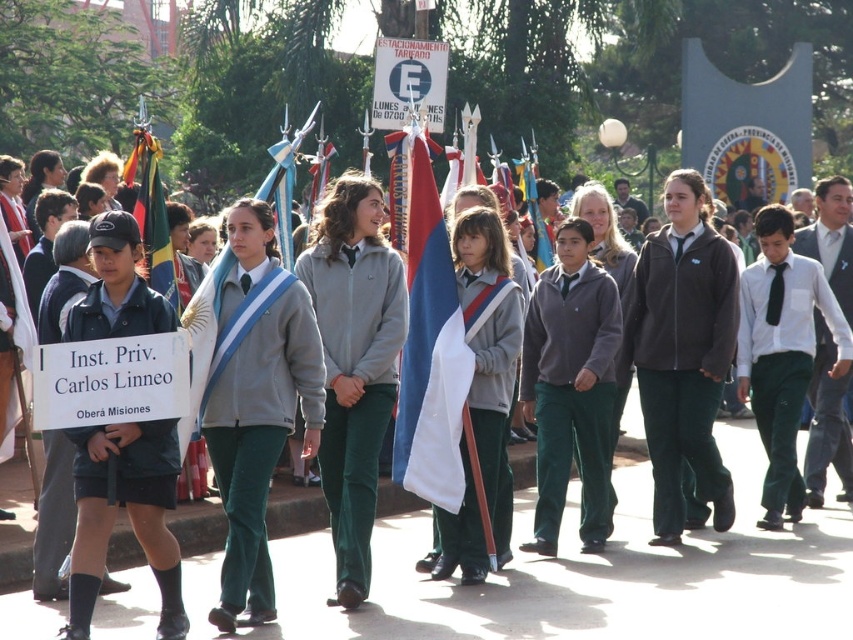
Is dark gray fleece jacket at center thinner than white fabric tie at center?

No.

Is point (688, 448) more distant than point (810, 390)?

No, it is in front of (810, 390).

In the scene shown: Who is more distant from viewer, (679, 413) or (844, 298)?

Positioned behind is point (844, 298).

At what (x,y) coordinates should I click in order to perform the action: click on dark gray fleece jacket at center. Please return your answer as a coordinate pair (x, y). This screenshot has height=640, width=853. Looking at the image, I should click on (682, 364).

Can you confirm if green fabric sash at center is shorter than white fabric sash at center?

Yes.

Between green fabric sash at center and white fabric sash at center, which one has less height?

Standing shorter between the two is green fabric sash at center.

Is point (244, 364) positioned behind point (498, 314)?

No, it is in front of (498, 314).

The image size is (853, 640). I want to click on green fabric sash at center, so click(276, 371).

Which is behind, point (585, 442) or point (141, 234)?

The point (141, 234) is behind.

Can you confirm if green fabric pants at center is bigger than blue and white fabric flag at center?

Indeed, green fabric pants at center has a larger size compared to blue and white fabric flag at center.

Is point (599, 532) positioned in front of point (144, 232)?

Yes, it is in front of point (144, 232).

The image size is (853, 640). What are the coordinates of `green fabric pants at center` in the screenshot? It's located at (572, 394).